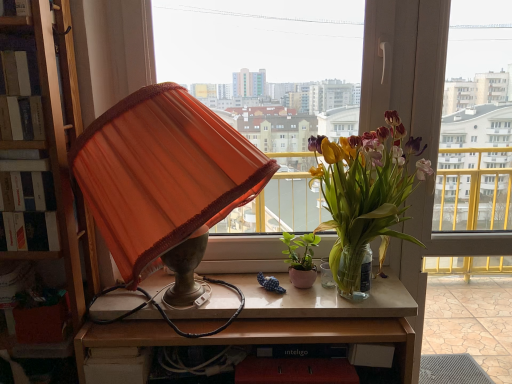
Question: Considering their positions, is green matte plant at center, arranged as the 2th houseplant when viewed from the right, located in front of or behind transparent glass window at center, the 2th window viewed from the left?

Choices:
 (A) front
 (B) behind

Answer: (B)

Question: From a real-world perspective, is green matte plant at center, arranged as the 2th houseplant when viewed from the right, above or below transparent glass window at center, placed as the first window when sorted from right to left?

Choices:
 (A) below
 (B) above

Answer: (A)

Question: Which object is positioned closest to the green matte plant at center, acting as the 1th houseplant starting from the left?

Choices:
 (A) translucent glass vase at upper right, the 2th houseplant when ordered from left to right
 (B) transparent glass window at center, placed as the first window when sorted from right to left
 (C) wooden table at center
 (D) hardcover book at left
 (E) orange fabric lampshade at left

Answer: (A)

Question: Estimate the real-world distances between objects in this image. Which object is farther from the orange fabric lampshade at left?

Choices:
 (A) hardcover book at left
 (B) green matte plant at center, acting as the 1th houseplant starting from the left
 (C) translucent glass vase at upper right, the first houseplant viewed from the right
 (D) transparent glass window at center, placed as the first window when sorted from left to right
 (E) transparent glass window at center, placed as the first window when sorted from right to left

Answer: (E)